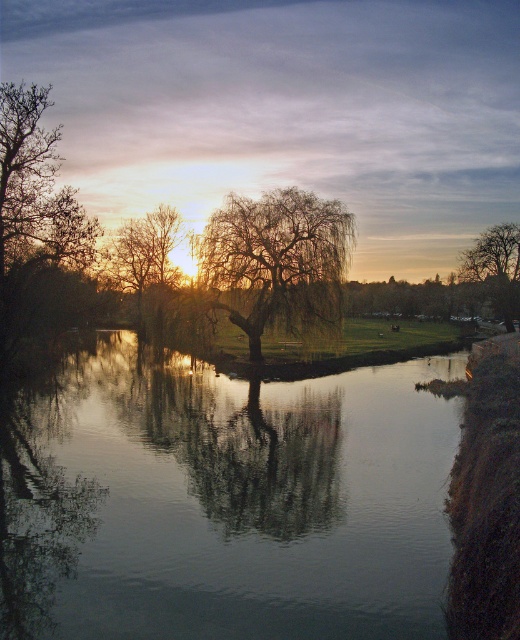
Question: Estimate the real-world distances between objects in this image. Which object is closer to the brown rough tree at right?

Choices:
 (A) transparent water at center
 (B) bare branches at center
 (C) willow tree at center

Answer: (B)

Question: Does bare branches at center appear under brown rough tree at right?

Choices:
 (A) yes
 (B) no

Answer: (A)

Question: Estimate the real-world distances between objects in this image. Which object is farther from the transparent water at center?

Choices:
 (A) brown rough tree at right
 (B) willow tree at center

Answer: (A)

Question: Is willow tree at center positioned behind bare branches at center?

Choices:
 (A) no
 (B) yes

Answer: (A)

Question: Estimate the real-world distances between objects in this image. Which object is farther from the willow tree at center?

Choices:
 (A) brown rough tree at right
 (B) bare branches at center
 (C) transparent water at center

Answer: (A)

Question: Is willow tree at center below brown rough tree at right?

Choices:
 (A) no
 (B) yes

Answer: (B)